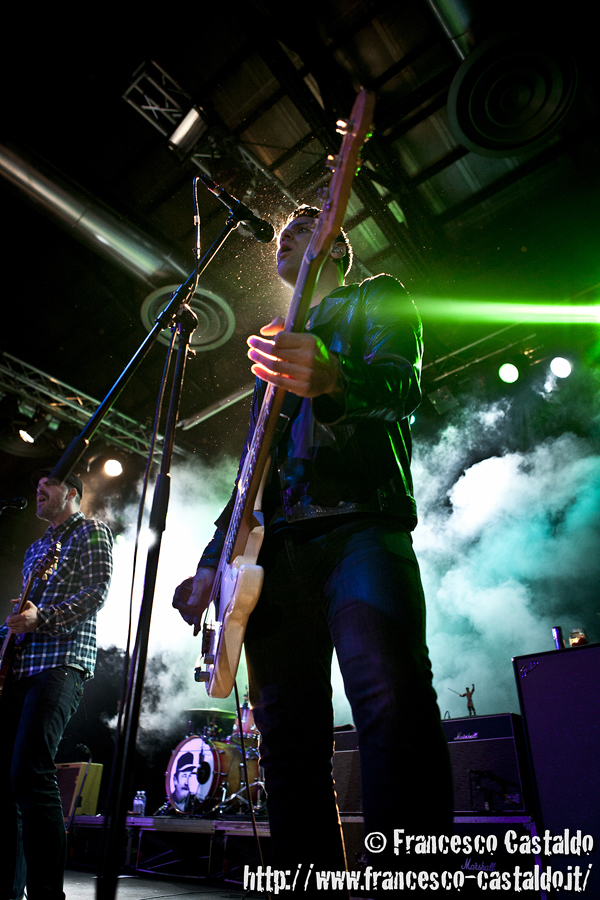
Where is `ceiling`? ceiling is located at coordinates (154, 163).